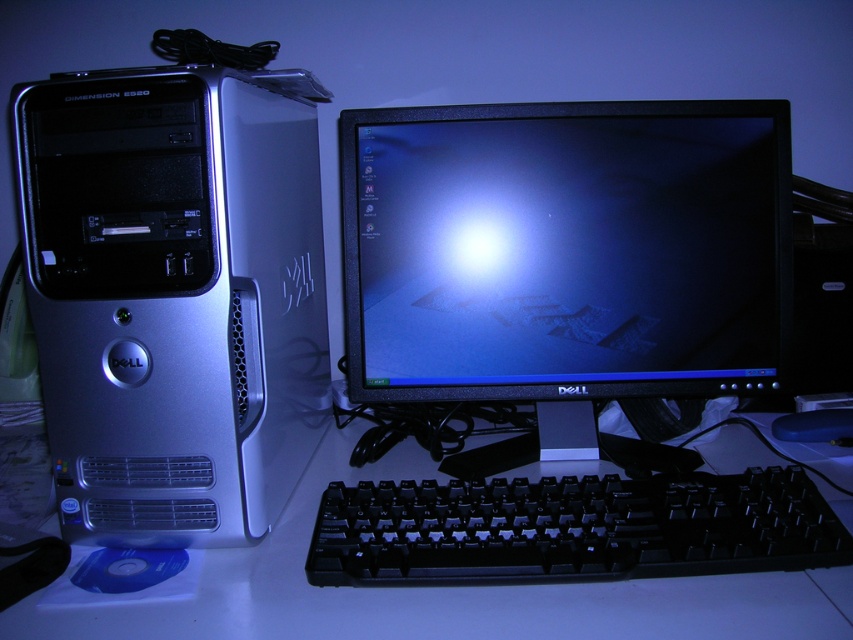
Question: Does satin silver computer tower at left have a smaller size compared to black plastic keyboard at lower center?

Choices:
 (A) yes
 (B) no

Answer: (B)

Question: Which is farther from the black plastic keyboard at lower center?

Choices:
 (A) black plastic mouse at lower right
 (B) black glossy monitor at center
 (C) satin silver computer tower at left
 (D) white plastic keyboard at lower center

Answer: (A)

Question: Which of the following is the closest to the observer?

Choices:
 (A) (664, 371)
 (B) (834, 410)
 (C) (252, 404)

Answer: (C)

Question: Does white plastic keyboard at lower center come behind black plastic mouse at lower right?

Choices:
 (A) no
 (B) yes

Answer: (A)

Question: Which is nearer to the black glossy monitor at center?

Choices:
 (A) white plastic keyboard at lower center
 (B) satin silver computer tower at left

Answer: (B)

Question: Does satin silver computer tower at left appear on the left side of white plastic keyboard at lower center?

Choices:
 (A) no
 (B) yes

Answer: (B)